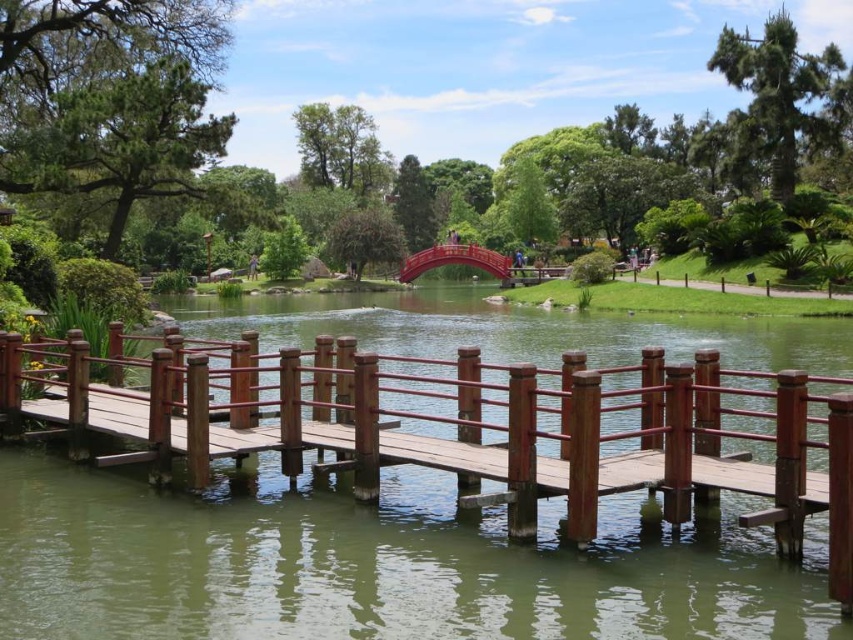
You are standing at the wooden bridge in the Japanese garden and want to walk to a specific point. You have two options to choose from, point A labeled as point (335, 385) and point B labeled as point (445, 257). Which point is closer to you?

Point A labeled as point (335, 385) is closer to you than point B labeled as point (445, 257).

You are a visitor in the Japanese garden and want to cross the water to reach the grassy area. You see the wooden dock at center and the shiny red bridge at center. Which structure should you use to cross the water safely?

The wooden dock at center is below the shiny red bridge at center, so you should use the shiny red bridge at center to cross the water safely as it is positioned above the water surface.